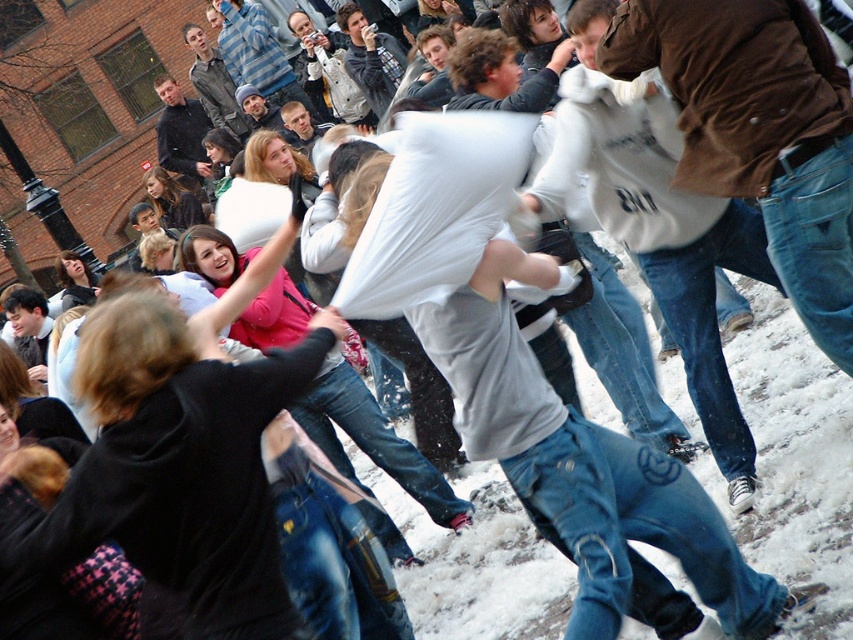
Is striped sweater at center below matte black jacket at upper left?

No.

Who is positioned more to the right, striped sweater at center or matte black jacket at upper left?

striped sweater at center

Is point (274, 33) positioned after point (172, 140)?

No, it is not.

The width and height of the screenshot is (853, 640). I want to click on striped sweater at center, so click(256, 52).

Between white cotton pillow at center and matte gray hoodie at center, which one has less height?

Standing shorter between the two is matte gray hoodie at center.

Locate an element on the screen. This screenshot has height=640, width=853. white cotton pillow at center is located at coordinates (589, 476).

Who is shorter, brown leather jacket at upper right or matte gray hoodie at center?

With less height is matte gray hoodie at center.

Does brown leather jacket at upper right come in front of matte gray hoodie at center?

Yes, brown leather jacket at upper right is closer to the viewer.

Is point (848, 202) farther from viewer compared to point (262, 124)?

No, (848, 202) is in front of (262, 124).

This screenshot has width=853, height=640. What are the coordinates of `brown leather jacket at upper right` in the screenshot? It's located at (759, 132).